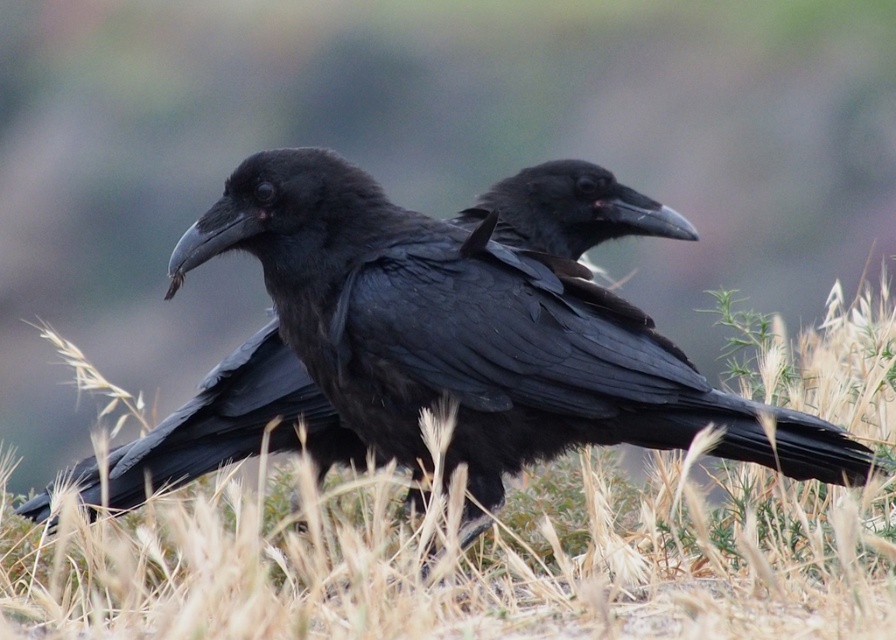
Question: Among these objects, which one is nearest to the camera?

Choices:
 (A) shiny black raven at center
 (B) dry grass at center

Answer: (B)

Question: In this image, where is dry grass at center located relative to shiny black raven at center?

Choices:
 (A) below
 (B) above

Answer: (A)

Question: Does dry grass at center appear on the right side of shiny black raven at center?

Choices:
 (A) yes
 (B) no

Answer: (A)

Question: Can you confirm if dry grass at center is positioned to the left of shiny black raven at center?

Choices:
 (A) no
 (B) yes

Answer: (A)